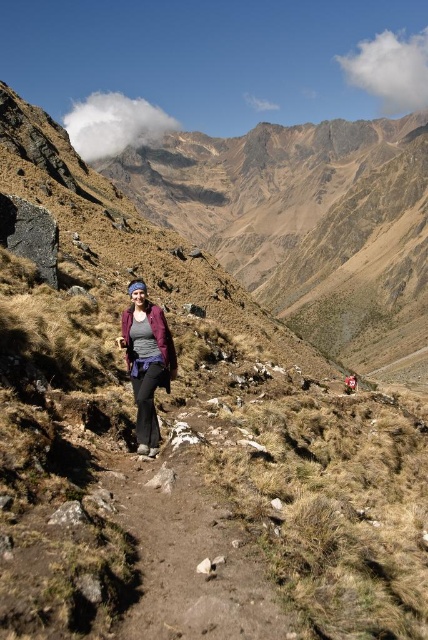
Who is lower down, brown rocky mountain at center or dirt path at center?

dirt path at center is lower down.

Identify the location of brown rocky mountain at center. The width and height of the screenshot is (428, 640). (282, 220).

Find the location of `brown rocky mountain at center`. brown rocky mountain at center is located at coordinates click(x=282, y=220).

Can you confirm if brown rocky mountain at center is taller than matte purple jacket at center?

Yes.

Is brown rocky mountain at center positioned behind matte purple jacket at center?

That is True.

I want to click on brown rocky mountain at center, so click(282, 220).

Where is `brown rocky mountain at center`? brown rocky mountain at center is located at coordinates (282, 220).

Is dirt path at center taller than matte purple jacket at center?

In fact, dirt path at center may be shorter than matte purple jacket at center.

Is dirt path at center bigger than matte purple jacket at center?

Correct, dirt path at center is larger in size than matte purple jacket at center.

Where is `dirt path at center`? dirt path at center is located at coordinates (190, 556).

Where is `dirt path at center`? This screenshot has height=640, width=428. dirt path at center is located at coordinates (190, 556).